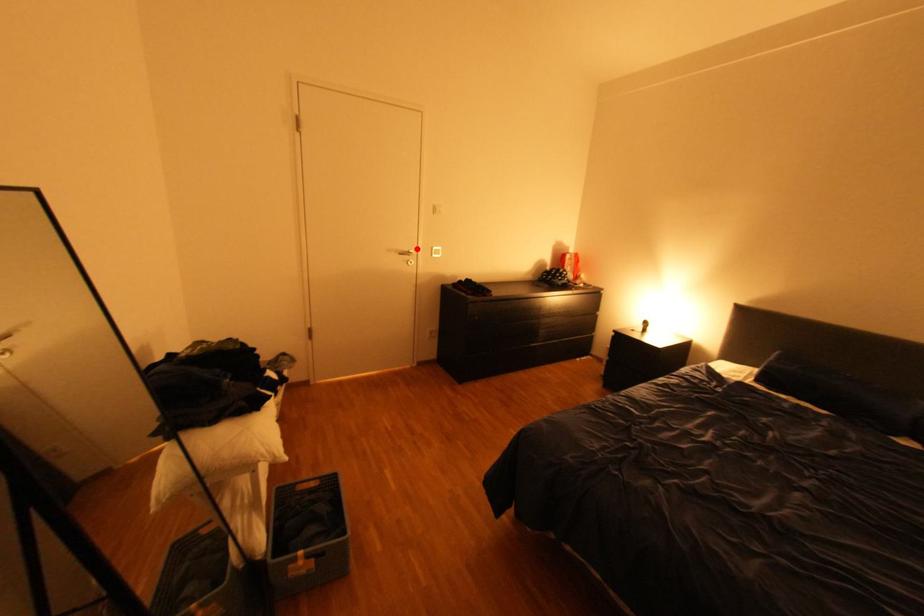
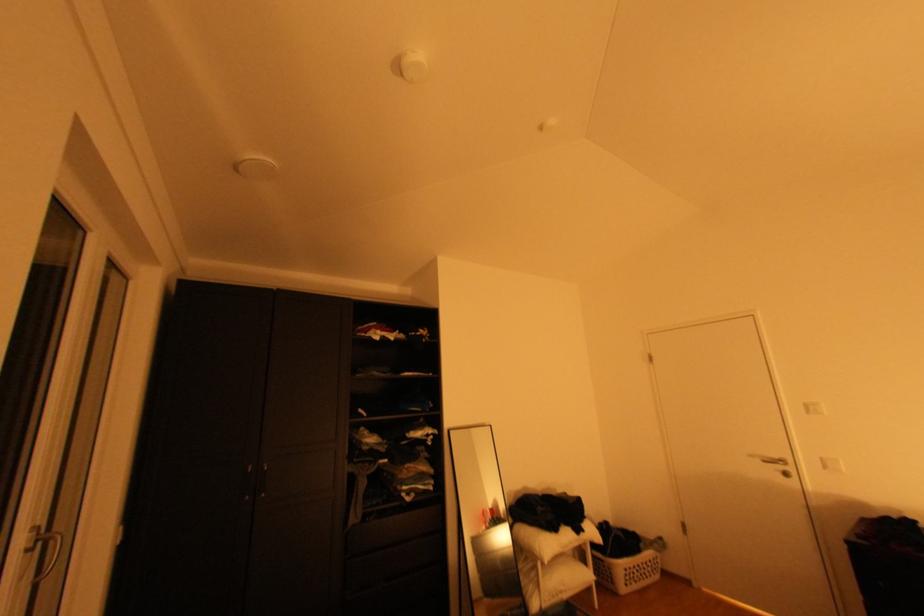
The point at the highlighted location is marked in the first image. Where is the corresponding point in the second image?

(786, 456)